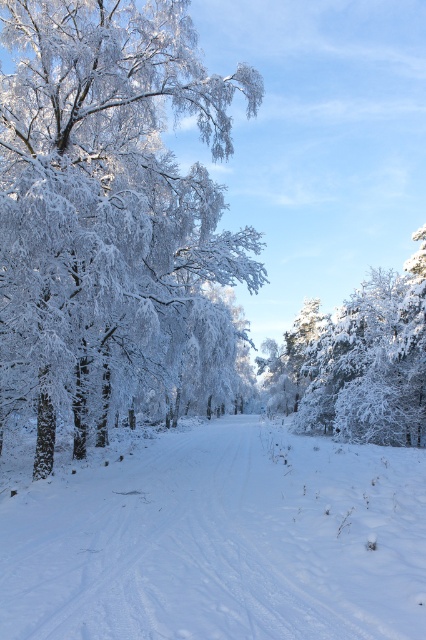
Looking at this image, who is lower down, white frosty tree at left or white snow at center?

white snow at center

Who is shorter, white frosty tree at left or white snow at center?

white snow at center

Who is more distant from viewer, [8,77] or [83,492]?

Point [8,77]

Locate an element on the screen. This screenshot has height=640, width=426. white frosty tree at left is located at coordinates (109, 209).

Based on the photo, which is more to the right, white frosty tree at left or white frosty tree at right?

white frosty tree at right

Who is positioned more to the left, white frosty tree at left or white frosty tree at right?

From the viewer's perspective, white frosty tree at left appears more on the left side.

Between point (74, 29) and point (339, 406), which one is positioned in front?

Point (74, 29) is more forward.

At what (x,y) coordinates should I click in order to perform the action: click on white frosty tree at left. Please return your answer as a coordinate pair (x, y). Image resolution: width=426 pixels, height=640 pixels. Looking at the image, I should click on (109, 209).

What do you see at coordinates (219, 540) in the screenshot? This screenshot has height=640, width=426. I see `white snow at center` at bounding box center [219, 540].

Does white snow at center appear on the left side of white frosty tree at right?

Yes, white snow at center is to the left of white frosty tree at right.

Identify the location of white snow at center. The image size is (426, 640). (219, 540).

Identify the location of white snow at center. Image resolution: width=426 pixels, height=640 pixels. (219, 540).